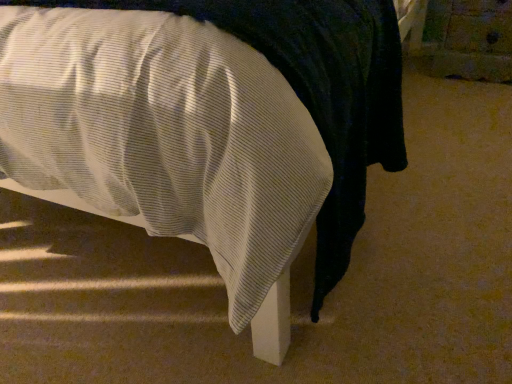
The width and height of the screenshot is (512, 384). I want to click on vacant area in front of wooden drawer at lower right, so click(x=472, y=100).